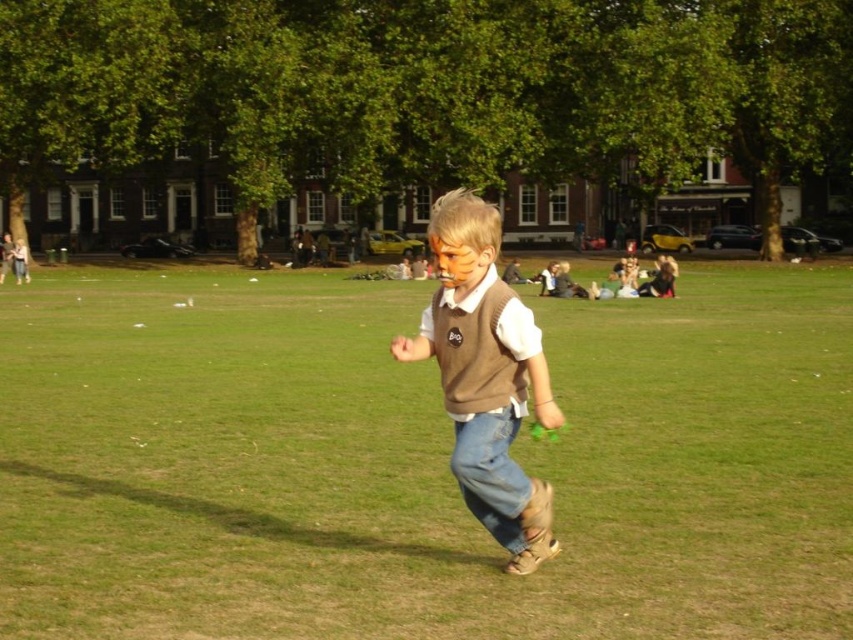
You are a photographer standing at the point marked as point (416, 461). You want to take a photo of the brown leather shoes at center. Since you are at the same point, can you see the brown leather shoes at center in your current position?

Yes, since you are at point (416, 461) where the brown leather shoes at center are located, you can see them directly in your current position.

You are standing at the origin point in the park scene. There are two points marked in the image. Which point, point (102, 426) or point (503, 442), is closer to you?

Point (503, 442) is closer to you because it is in front of point (102, 426) according to the spatial description.